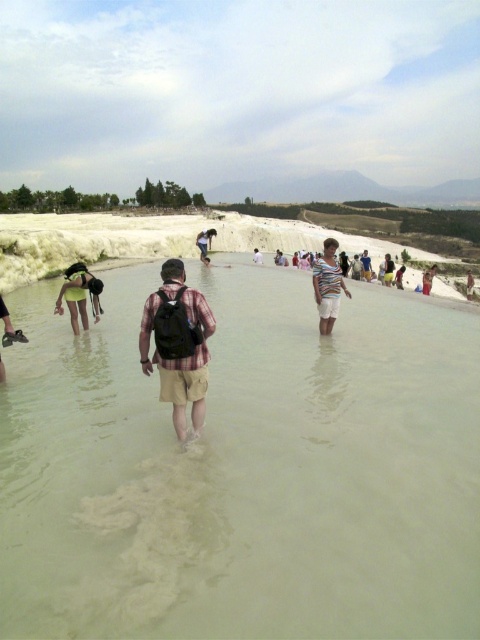
Which is above, plaid fabric shirt at center or light blue fabric shirt at center?

Positioned higher is light blue fabric shirt at center.

Is plaid fabric shirt at center smaller than light blue fabric shirt at center?

Indeed, plaid fabric shirt at center has a smaller size compared to light blue fabric shirt at center.

Between point (199, 330) and point (421, 291), which one is positioned in front?

Positioned in front is point (199, 330).

Identify the location of plaid fabric shirt at center. (178, 344).

Consider the image. Between matte black backpack at center and light blue denim shorts at center, which one is positioned lower?

light blue denim shorts at center is below.

Is matte black backpack at center taller than light blue denim shorts at center?

Yes.

Is point (204, 236) behind point (384, 269)?

Yes, it is.

Find the location of a particular element. matte black backpack at center is located at coordinates (204, 243).

Is striped cotton shirt at center smaller than light blue denim shorts at center?

Incorrect, striped cotton shirt at center is not smaller in size than light blue denim shorts at center.

Is point (324, 308) positioned behind point (383, 268)?

No, it is in front of (383, 268).

In order to click on striped cotton shirt at center in this screenshot , I will do `click(327, 285)`.